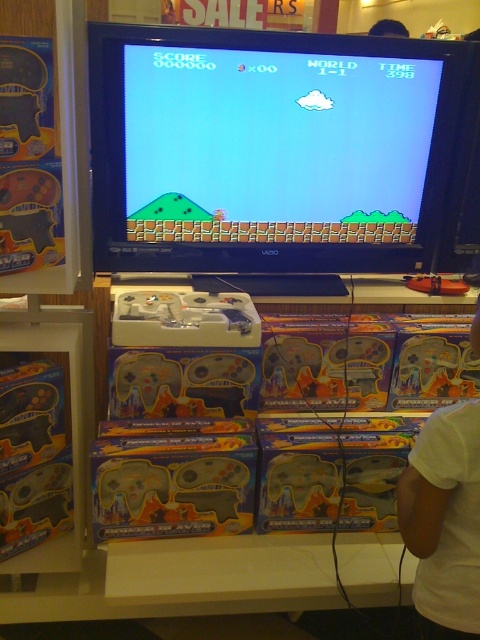
You are a store employee arranging items on a shelf. You have a matte plastic video game at center and a white cotton shirt at lower right. Which item takes up more space on the shelf?

The matte plastic video game at center is larger in size than the white cotton shirt at lower right, so it takes up more space on the shelf.

You are a customer in the store looking at the display. You want to pick up the white cotton shirt at lower right. Can you reach it without moving the matte plastic video game at center?

The white cotton shirt at lower right is behind the matte plastic video game at center, so you can reach it without moving the game since it is positioned behind it.

You are a customer at the store and want to place both the matte plastic video game at center and the white cotton shirt at lower right into a shopping bag. Which object requires a wider bag opening?

The matte plastic video game at center requires a wider bag opening because its width surpasses that of the white cotton shirt at lower right.